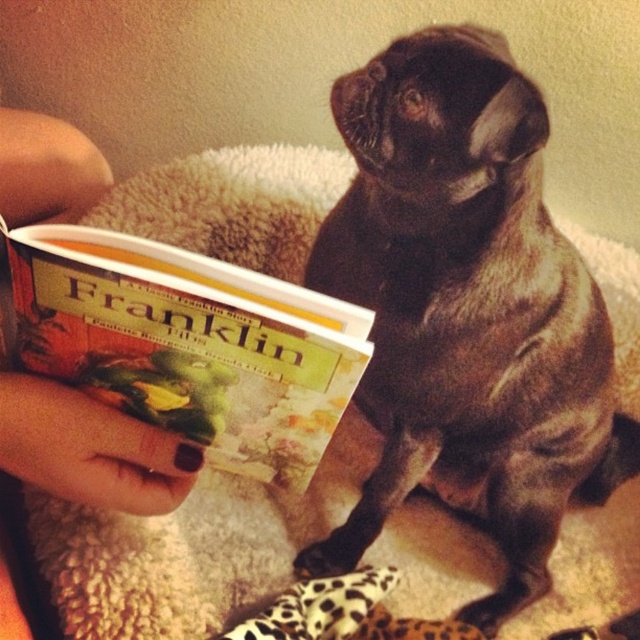
Question: Which point is farther to the camera?

Choices:
 (A) (445, 86)
 (B) (81, 442)
 (C) (244, 342)

Answer: (A)

Question: Observing the image, what is the correct spatial positioning of brown furry dog at center in reference to nail polish at upper left?

Choices:
 (A) above
 (B) below

Answer: (A)

Question: Does hardcover book at upper left come in front of nail polish at upper left?

Choices:
 (A) yes
 (B) no

Answer: (A)

Question: From the image, what is the correct spatial relationship of brown furry dog at center in relation to nail polish at upper left?

Choices:
 (A) right
 (B) left

Answer: (A)

Question: Which point is closer to the camera?

Choices:
 (A) (252, 474)
 (B) (602, 410)
 (C) (33, 444)

Answer: (C)

Question: Which point is closer to the camera?

Choices:
 (A) (486, 129)
 (B) (56, 461)

Answer: (B)